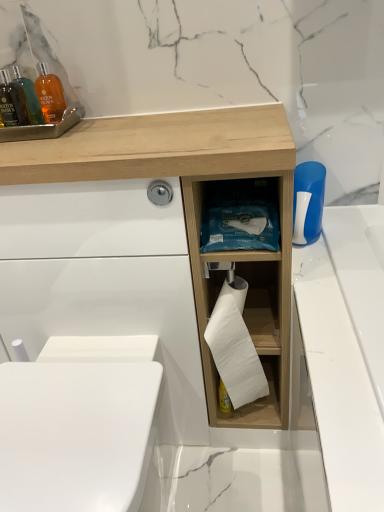
In order to click on empty space that is ontop of white glossy toilet bowl at lower left (from a real-world perspective) in this screenshot , I will do `click(80, 406)`.